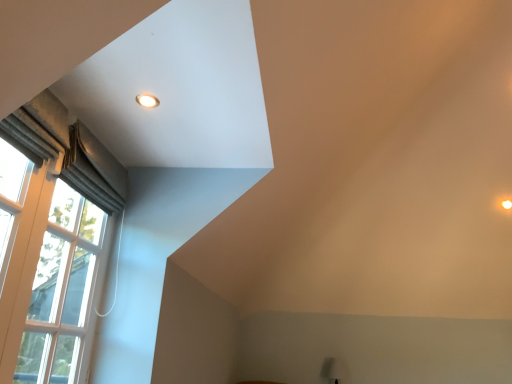
Question: Considering the positions of matte white light fixture at upper left and white textured curtain at left in the image, is matte white light fixture at upper left bigger or smaller than white textured curtain at left?

Choices:
 (A) small
 (B) big

Answer: (A)

Question: Is matte white light fixture at upper left spatially inside white textured curtain at left, or outside of it?

Choices:
 (A) outside
 (B) inside

Answer: (A)

Question: Estimate the real-world distances between objects in this image. Which object is closer to the matte white table lamp at lower right?

Choices:
 (A) matte white light fixture at upper left
 (B) satin grey curtain at left
 (C) white textured curtain at left

Answer: (C)

Question: Based on their relative distances, which object is farther from the white textured curtain at left?

Choices:
 (A) matte white light fixture at upper left
 (B) matte white table lamp at lower right
 (C) satin grey curtain at left

Answer: (B)